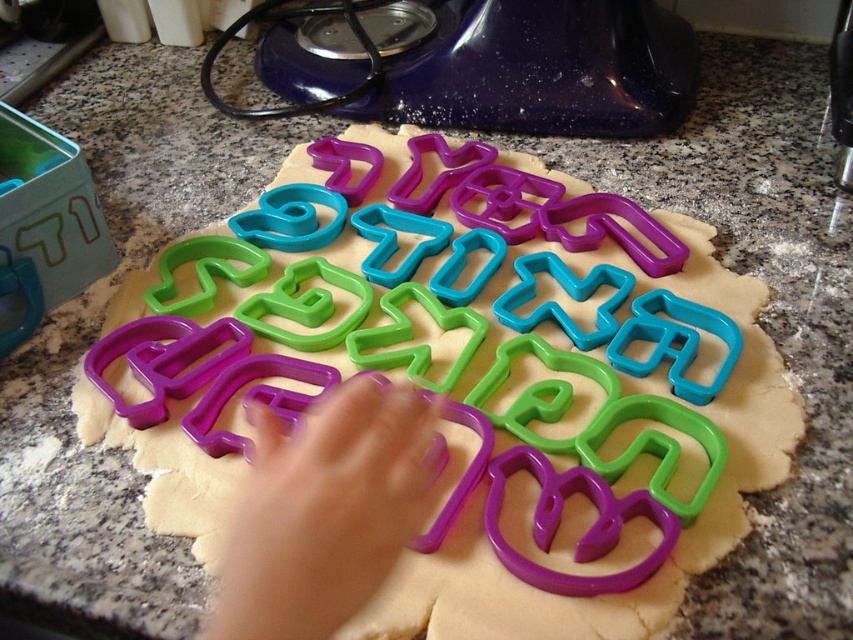
Can you confirm if purple plastic cookie cutters at center is taller than purple plastic hand at center?

Yes.

The image size is (853, 640). What do you see at coordinates (459, 374) in the screenshot?
I see `purple plastic cookie cutters at center` at bounding box center [459, 374].

This screenshot has width=853, height=640. I want to click on purple plastic cookie cutters at center, so click(459, 374).